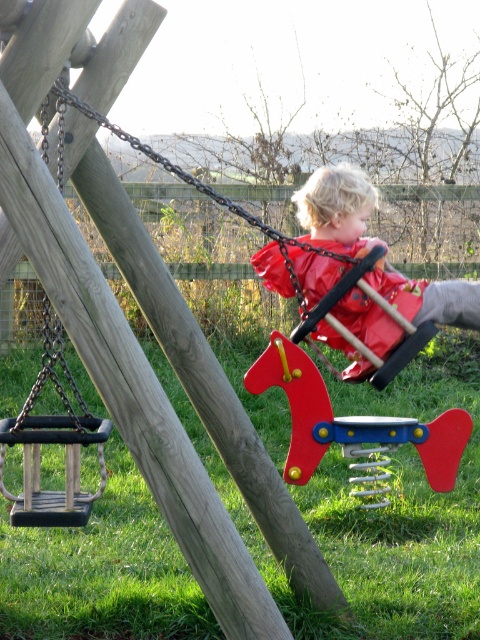
Question: Which point appears farthest from the camera in this image?

Choices:
 (A) (377, 372)
 (B) (275, 380)

Answer: (B)

Question: Is rubberized red swing at center behind red plastic spring at center?

Choices:
 (A) no
 (B) yes

Answer: (A)

Question: Which of the following is the closest to the observer?

Choices:
 (A) wooden swing at center
 (B) rubberized red swing at center
 (C) red plastic spring at center

Answer: (A)

Question: Is red plastic spring at center closer to camera compared to wooden swing at center?

Choices:
 (A) no
 (B) yes

Answer: (A)

Question: Can you confirm if rubberized red swing at center is bigger than red plastic spring at center?

Choices:
 (A) yes
 (B) no

Answer: (B)

Question: Based on their relative distances, which object is nearer to the rubberized red swing at center?

Choices:
 (A) wooden swing at center
 (B) red plastic spring at center

Answer: (A)